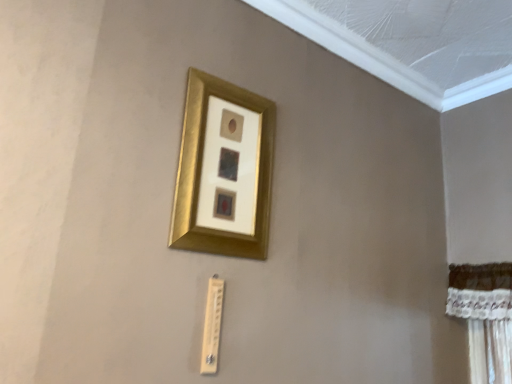
The height and width of the screenshot is (384, 512). What are the coordinates of `wooden thermometer at lower center` in the screenshot? It's located at (212, 325).

This screenshot has width=512, height=384. Describe the element at coordinates (212, 325) in the screenshot. I see `wooden thermometer at lower center` at that location.

Find the location of a particular element. The height and width of the screenshot is (384, 512). gold metallic picture frame at upper center is located at coordinates (224, 170).

The height and width of the screenshot is (384, 512). What do you see at coordinates (224, 170) in the screenshot? I see `gold metallic picture frame at upper center` at bounding box center [224, 170].

Identify the location of wooden thermometer at lower center. Image resolution: width=512 pixels, height=384 pixels. (212, 325).

Can you confirm if wooden thermometer at lower center is positioned to the right of gold metallic picture frame at upper center?

No.

Which object is closer to the camera, wooden thermometer at lower center or gold metallic picture frame at upper center?

Positioned in front is gold metallic picture frame at upper center.

Which is behind, point (217, 317) or point (208, 94)?

The point (208, 94) is farther.

From the image's perspective, is wooden thermometer at lower center positioned above or below gold metallic picture frame at upper center?

From the image's perspective, wooden thermometer at lower center appears below gold metallic picture frame at upper center.

From a real-world perspective, which is physically below, wooden thermometer at lower center or gold metallic picture frame at upper center?

From a 3D spatial view, wooden thermometer at lower center is below.

Is wooden thermometer at lower center wider or thinner than gold metallic picture frame at upper center?

Clearly, wooden thermometer at lower center has less width compared to gold metallic picture frame at upper center.

Is wooden thermometer at lower center shorter than gold metallic picture frame at upper center?

Yes, wooden thermometer at lower center is shorter than gold metallic picture frame at upper center.

From the picture: Is wooden thermometer at lower center bigger than gold metallic picture frame at upper center?

No, wooden thermometer at lower center is not bigger than gold metallic picture frame at upper center.

Is gold metallic picture frame at upper center located within wooden thermometer at lower center?

That's incorrect, gold metallic picture frame at upper center is not inside wooden thermometer at lower center.

Is wooden thermometer at lower center with gold metallic picture frame at upper center?

wooden thermometer at lower center and gold metallic picture frame at upper center are clearly separated.

Does wooden thermometer at lower center turn towards gold metallic picture frame at upper center?

No, wooden thermometer at lower center is not facing towards gold metallic picture frame at upper center.

What's the angular difference between wooden thermometer at lower center and gold metallic picture frame at upper center's facing directions?

The angular difference between wooden thermometer at lower center and gold metallic picture frame at upper center is 0.000321 degrees.

You are a GUI agent. You are given a task and a screenshot of the screen. Output one action in this format:
    pyautogui.click(x=<x>, y=<y>)
    Task: Click on the picture frame that is above the wooden thermometer at lower center (from a real-world perspective)
    The image size is (512, 384).
    Given the screenshot: What is the action you would take?
    pyautogui.click(x=224, y=170)

Does gold metallic picture frame at upper center appear on the left side of wooden thermometer at lower center?

In fact, gold metallic picture frame at upper center is to the right of wooden thermometer at lower center.

Considering the positions of objects gold metallic picture frame at upper center and wooden thermometer at lower center in the image provided, who is behind, gold metallic picture frame at upper center or wooden thermometer at lower center?

wooden thermometer at lower center is more distant.

Which is behind, point (251, 133) or point (218, 322)?

Positioned behind is point (251, 133).

From the image's perspective, does gold metallic picture frame at upper center appear lower than wooden thermometer at lower center?

Actually, gold metallic picture frame at upper center appears above wooden thermometer at lower center in the image.

From a real-world perspective, is gold metallic picture frame at upper center located beneath wooden thermometer at lower center?

Actually, gold metallic picture frame at upper center is physically above wooden thermometer at lower center in the real world.

Which of these two, gold metallic picture frame at upper center or wooden thermometer at lower center, is wider?

gold metallic picture frame at upper center.

Does gold metallic picture frame at upper center have a lesser height compared to wooden thermometer at lower center?

No, gold metallic picture frame at upper center is not shorter than wooden thermometer at lower center.

Considering the relative sizes of gold metallic picture frame at upper center and wooden thermometer at lower center in the image provided, is gold metallic picture frame at upper center smaller than wooden thermometer at lower center?

No, gold metallic picture frame at upper center is not smaller than wooden thermometer at lower center.

In the scene shown: Can wooden thermometer at lower center be found inside gold metallic picture frame at upper center?

No, wooden thermometer at lower center is located outside of gold metallic picture frame at upper center.

Is gold metallic picture frame at upper center not close to wooden thermometer at lower center?

No, gold metallic picture frame at upper center is not far away from wooden thermometer at lower center.

Is gold metallic picture frame at upper center oriented away from wooden thermometer at lower center?

No, gold metallic picture frame at upper center's orientation is not away from wooden thermometer at lower center.

How different are the orientations of gold metallic picture frame at upper center and wooden thermometer at lower center in degrees?

The angle between the facing direction of gold metallic picture frame at upper center and the facing direction of wooden thermometer at lower center is 0.000321 degrees.

The width and height of the screenshot is (512, 384). There is a wooden thermometer at lower center. Identify the location of picture frame above it (from a real-world perspective). (224, 170).

Where is `picture frame that appears on the right of wooden thermometer at lower center`? picture frame that appears on the right of wooden thermometer at lower center is located at coordinates (224, 170).

What are the coordinates of `picture frame above the wooden thermometer at lower center (from the image's perspective)` in the screenshot? It's located at (224, 170).